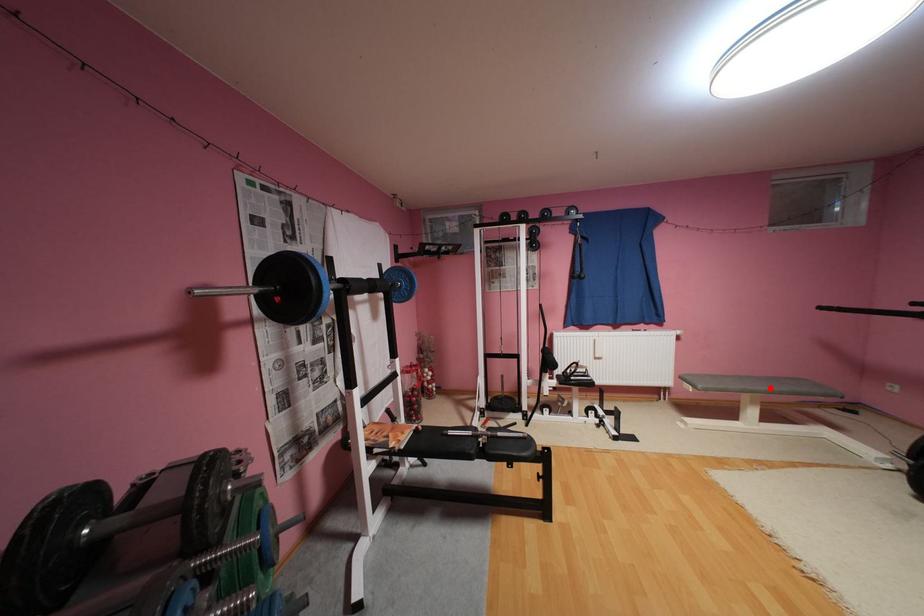
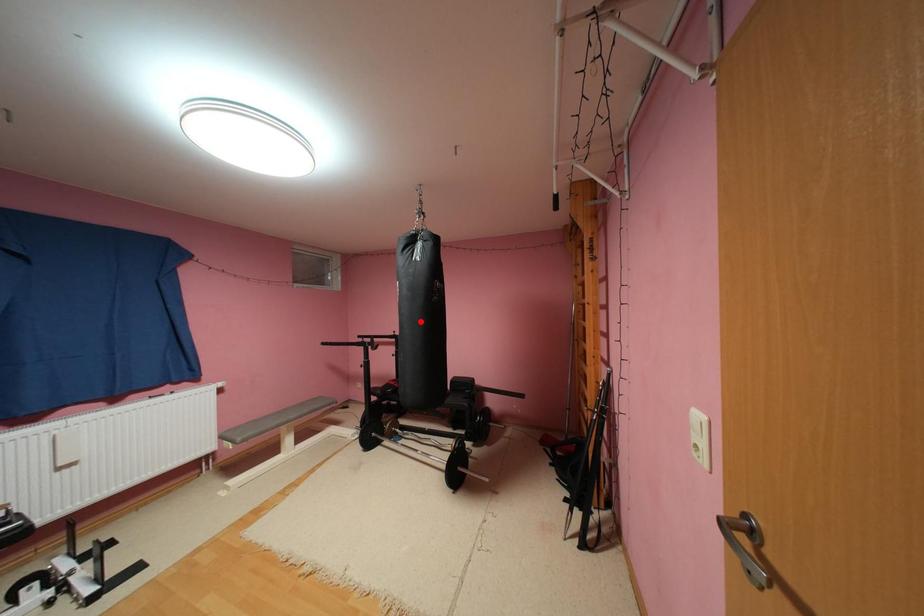
I am providing you with two images of the same scene from different viewpoints. A red point is marked on the first image and another point is marked on the second image. Are the points marked in image1 and image2 representing the same 3D position?

No